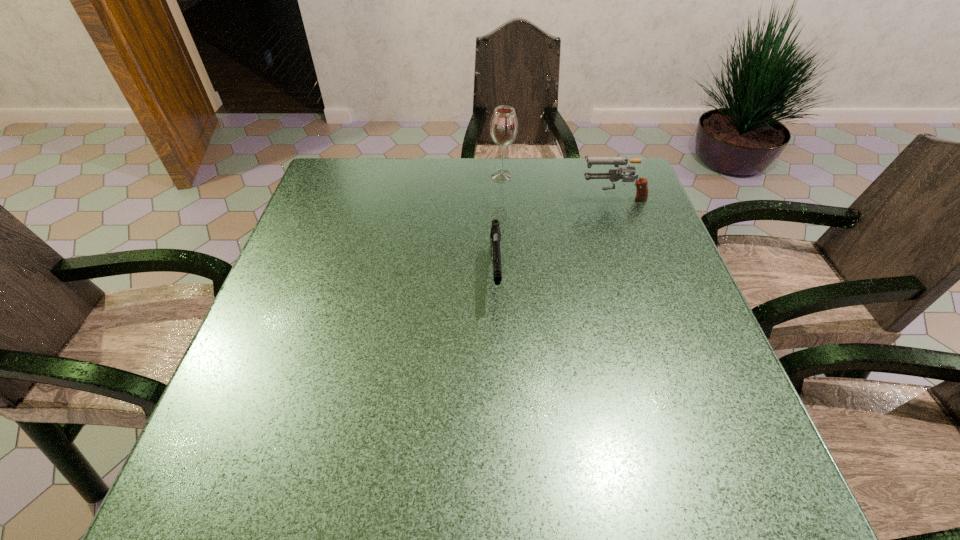
I want to click on vacant space at the far right corner, so click(630, 172).

This screenshot has height=540, width=960. What are the coordinates of `vacant area between the second tallest object and the shortest object` in the screenshot? It's located at (554, 236).

Find the location of a particular element. The height and width of the screenshot is (540, 960). free spot between the nearest object and the second tallest object is located at coordinates (554, 236).

Locate an element on the screen. This screenshot has width=960, height=540. vacant space that is in between the shorter gun and the rightmost object is located at coordinates (554, 236).

You are a GUI agent. You are given a task and a screenshot of the screen. Output one action in this format:
    pyautogui.click(x=<x>, y=<y>)
    Task: Click on the vacant space that's between the taller gun and the tallest object
    This screenshot has width=960, height=540.
    Given the screenshot: What is the action you would take?
    pyautogui.click(x=557, y=186)

I want to click on unoccupied position between the taller gun and the farthest object, so click(557, 186).

You are a GUI agent. You are given a task and a screenshot of the screen. Output one action in this format:
    pyautogui.click(x=<x>, y=<y>)
    Task: Click on the vacant space that's between the right gun and the left gun
    
    Given the screenshot: What is the action you would take?
    (x=554, y=236)

Locate an element on the screen. free space that is in between the farther gun and the wineglass is located at coordinates (557, 186).

Identify which object is located as the second nearest to the rightmost object. Please provide its 2D coordinates. Your answer should be formatted as a tuple, i.e. [(x, y)], where the tuple contains the x and y coordinates of a point satisfying the conditions above.

[(495, 236)]

Image resolution: width=960 pixels, height=540 pixels. Find the location of `object that stands as the second closest to the farthest object`. object that stands as the second closest to the farthest object is located at coordinates (495, 236).